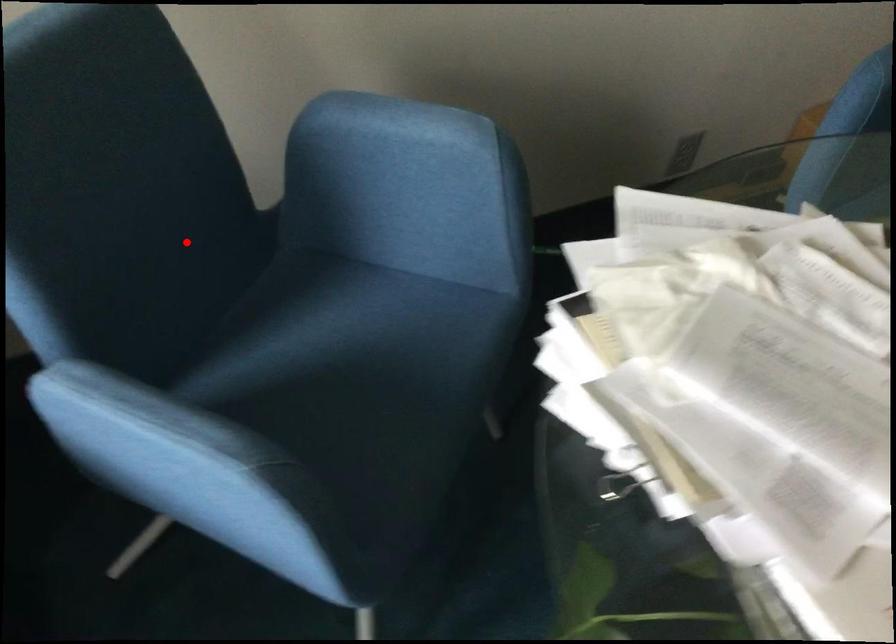
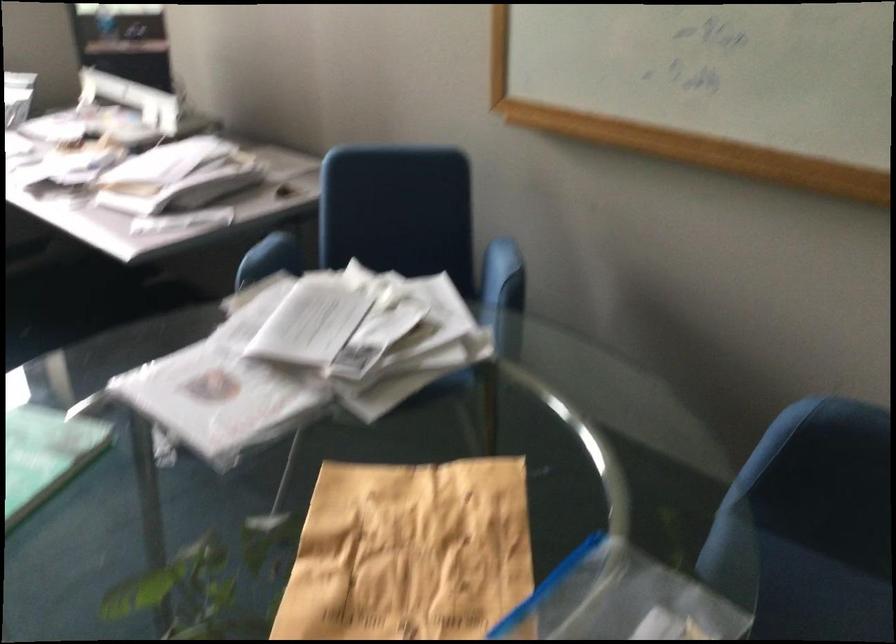
Question: I am providing you with two images of the same scene from different viewpoints. Given a red point in image1, look at the same physical point in image2. Is it:

Choices:
 (A) Closer to the viewpoint
 (B) Farther from the viewpoint

Answer: (B)